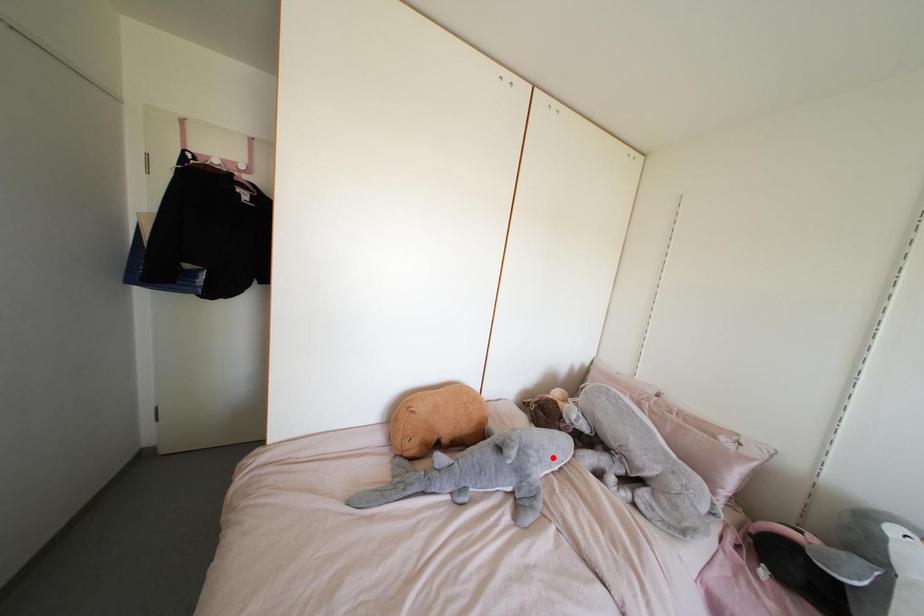
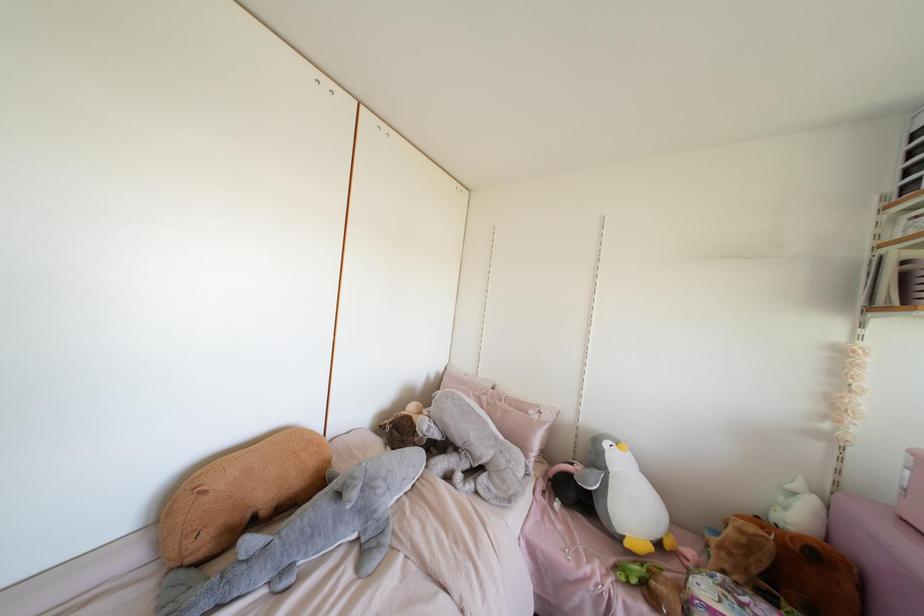
Where in the second image is the point corresponding to the highlighted location from the first image?

(403, 479)